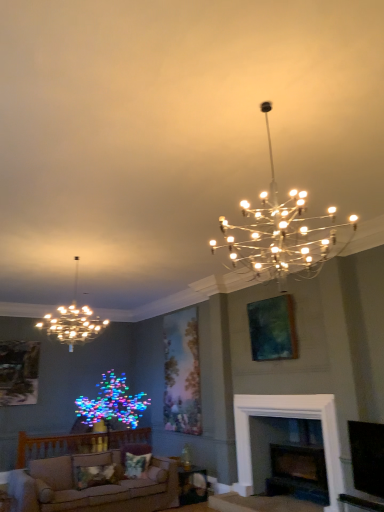
Question: Is dark wood fireplace at lower center next to teal matte painting at upper right, marked as the 2th picture frame in a bottom-to-top arrangement, and touching it?

Choices:
 (A) yes
 (B) no

Answer: (B)

Question: Is dark wood fireplace at lower center taller than teal matte painting at upper right, marked as the 2th picture frame in a bottom-to-top arrangement?

Choices:
 (A) no
 (B) yes

Answer: (B)

Question: Considering the relative sizes of dark wood fireplace at lower center and teal matte painting at upper right, arranged as the first picture frame when viewed from the top, in the image provided, is dark wood fireplace at lower center wider than teal matte painting at upper right, arranged as the first picture frame when viewed from the top,?

Choices:
 (A) yes
 (B) no

Answer: (A)

Question: Is dark wood fireplace at lower center not near teal matte painting at upper right, marked as the 2th picture frame in a bottom-to-top arrangement?

Choices:
 (A) no
 (B) yes

Answer: (A)

Question: From a real-world perspective, is dark wood fireplace at lower center on top of teal matte painting at upper right, marked as the 2th picture frame in a bottom-to-top arrangement?

Choices:
 (A) yes
 (B) no

Answer: (B)

Question: In the image, is dark wood fireplace at lower center on the left side or the right side of wooden table at lower center?

Choices:
 (A) left
 (B) right

Answer: (B)

Question: Considering the positions of dark wood fireplace at lower center and wooden table at lower center in the image, is dark wood fireplace at lower center taller or shorter than wooden table at lower center?

Choices:
 (A) tall
 (B) short

Answer: (A)

Question: Would you say dark wood fireplace at lower center is inside or outside wooden table at lower center?

Choices:
 (A) outside
 (B) inside

Answer: (A)

Question: Considering their positions, is dark wood fireplace at lower center located in front of or behind wooden table at lower center?

Choices:
 (A) front
 (B) behind

Answer: (A)

Question: From the image's perspective, relative to wooden table at lower center, is fluffy fabric pillow at lower center above or below?

Choices:
 (A) above
 (B) below

Answer: (A)

Question: Is fluffy fabric pillow at lower center wider or thinner than wooden table at lower center?

Choices:
 (A) thin
 (B) wide

Answer: (A)

Question: From their relative heights in the image, would you say fluffy fabric pillow at lower center is taller or shorter than wooden table at lower center?

Choices:
 (A) short
 (B) tall

Answer: (A)

Question: Visually, is fluffy fabric pillow at lower center positioned to the left or to the right of wooden table at lower center?

Choices:
 (A) left
 (B) right

Answer: (A)

Question: Is wooden textured picture frame at left, which is counted as the 1th picture frame, starting from the left, spatially inside beige fabric couch at lower left, or outside of it?

Choices:
 (A) outside
 (B) inside

Answer: (A)

Question: Considering the positions of wooden textured picture frame at left, the second picture frame positioned from the right, and beige fabric couch at lower left in the image, is wooden textured picture frame at left, the second picture frame positioned from the right, taller or shorter than beige fabric couch at lower left?

Choices:
 (A) tall
 (B) short

Answer: (A)